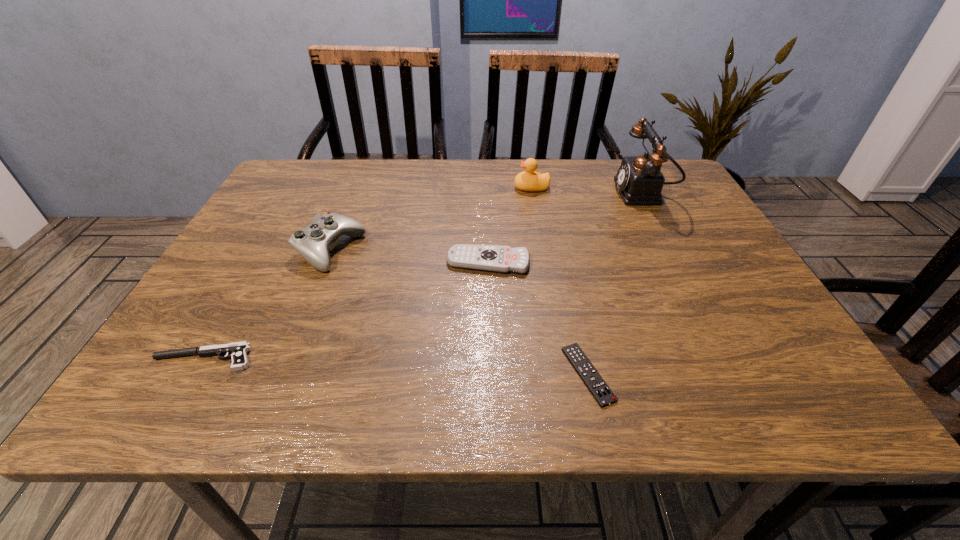
Identify the location of vacant area that lies between the third tallest object and the duck. (431, 219).

I want to click on unoccupied area between the farther remote control and the duck, so click(510, 225).

Locate an element on the screen. The image size is (960, 540). object that is the fourth closest one to the control is located at coordinates pyautogui.click(x=594, y=382).

The image size is (960, 540). Find the location of `the fifth closest object to the rightmost object`. the fifth closest object to the rightmost object is located at coordinates (237, 351).

Locate an element on the screen. blank space that satisfies the following two spatial constraints: 1. on the back side of the right remote control; 2. on the front-facing side of the pistol is located at coordinates (585, 358).

Where is `vacant position in the image that satisfies the following two spatial constraints: 1. on the back side of the shortest object; 2. on the face of the duck`? The image size is (960, 540). vacant position in the image that satisfies the following two spatial constraints: 1. on the back side of the shortest object; 2. on the face of the duck is located at coordinates click(x=547, y=188).

Find the location of `blank area in the image that satisfies the following two spatial constraints: 1. on the front-facing side of the fifth tallest object; 2. on the left side of the shortest object`. blank area in the image that satisfies the following two spatial constraints: 1. on the front-facing side of the fifth tallest object; 2. on the left side of the shortest object is located at coordinates (195, 374).

The height and width of the screenshot is (540, 960). Find the location of `vacant space that satisfies the following two spatial constraints: 1. on the face of the fifth shortest object; 2. on the back side of the right remote control`. vacant space that satisfies the following two spatial constraints: 1. on the face of the fifth shortest object; 2. on the back side of the right remote control is located at coordinates (563, 374).

This screenshot has height=540, width=960. Identify the location of free space that satisfies the following two spatial constraints: 1. on the front of the telephone at the rotary dial; 2. on the front side of the left remote control. (678, 262).